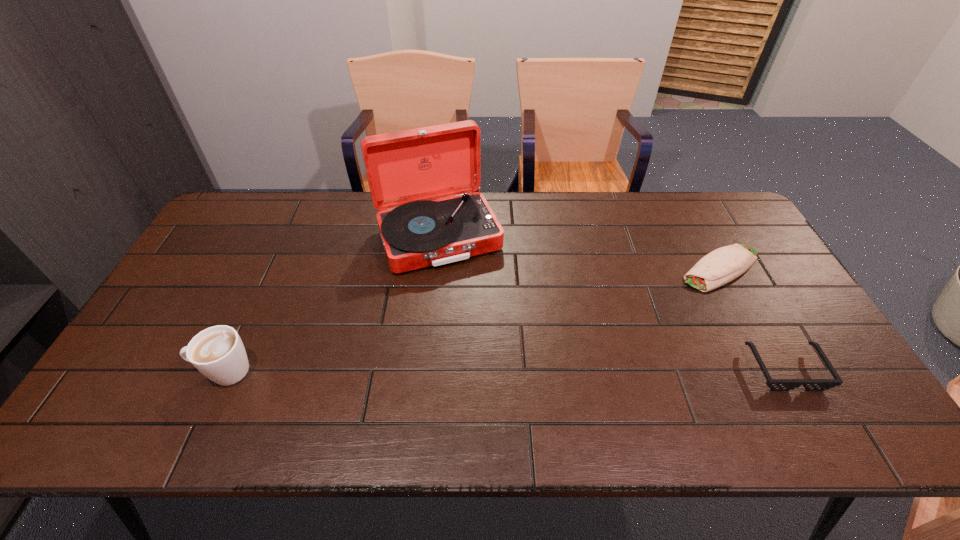
Where is `vacant space at the near edge`? The height and width of the screenshot is (540, 960). vacant space at the near edge is located at coordinates (474, 387).

Image resolution: width=960 pixels, height=540 pixels. In the image, there is a desktop. Identify the location of vacant space at the right edge. (785, 360).

The width and height of the screenshot is (960, 540). I want to click on free space at the far left corner of the desktop, so click(250, 217).

In the image, there is a desktop. Where is `vacant space at the far right corner`? vacant space at the far right corner is located at coordinates tap(701, 222).

Identify the location of free point between the phonograph_record and the burrito. (579, 252).

The width and height of the screenshot is (960, 540). Identify the location of vacant area that lies between the leftmost object and the sunglasses. (505, 370).

The height and width of the screenshot is (540, 960). What are the coordinates of `blank region between the tallest object and the cappuccino` in the screenshot? It's located at (331, 303).

Find the location of a particular element. This screenshot has height=540, width=960. vacant space that is in between the burrito and the sunglasses is located at coordinates (753, 318).

At what (x,y) coordinates should I click in order to perform the action: click on vacant space that is in between the sunglasses and the tallest object. Please return your answer as a coordinate pair (x, y). This screenshot has height=540, width=960. Looking at the image, I should click on (612, 302).

This screenshot has height=540, width=960. Identify the location of free space between the burrito and the sunglasses. (753, 318).